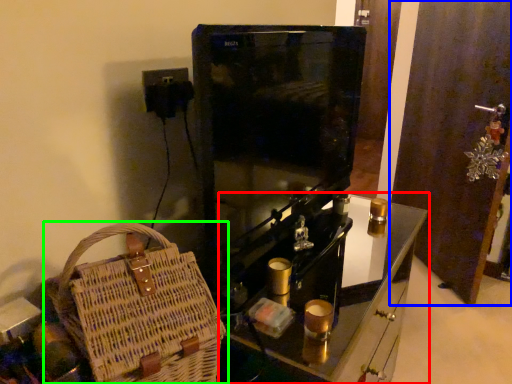
Question: Which object is positioned farthest from furniture (highlighted by a red box)? Select from door (highlighted by a blue box) and handbag (highlighted by a green box).

Choices:
 (A) door
 (B) handbag

Answer: (A)